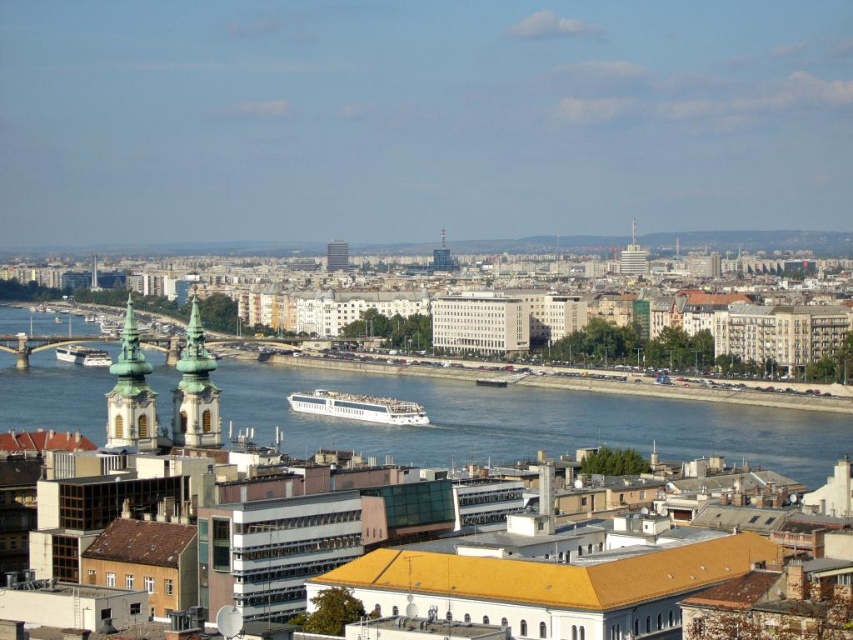
You are a photographer planning to capture the entire white glossy cruise ship at center and the blue waterway at center in a single shot. Given that your camera has a fixed focal length, which object should you prioritize framing first to ensure both are visible?

The blue waterway at center is wider than the white glossy cruise ship at center. To ensure both are visible in the shot, you should prioritize framing the wider blue waterway at center first, as it occupies more space in the scene.

You are a photographer planning to capture the entire white glossy cruise ship at center and the matte glass skyscraper at center in a single frame. Based on their widths, which object should you position closer to the center of your camera viewfinder to ensure both fit without cropping?

The white glossy cruise ship at center is wider than the matte glass skyscraper at center. To capture both in a single frame without cropping, position the cruise ship closer to the center of the camera viewfinder since its greater width requires more space.